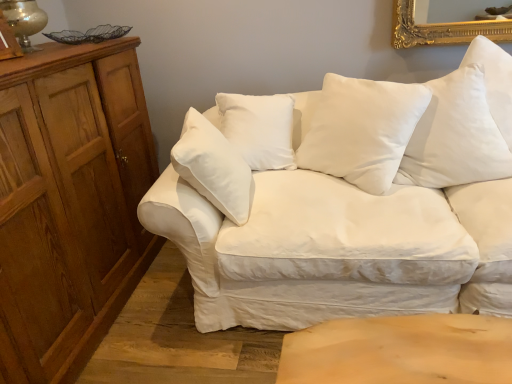
Question: Can you confirm if white cotton pillow at upper right, marked as the first pillow in a right-to-left arrangement, is wider than wooden dresser at left?

Choices:
 (A) no
 (B) yes

Answer: (A)

Question: Can you confirm if white cotton pillow at upper right, marked as the first pillow in a right-to-left arrangement, is shorter than wooden dresser at left?

Choices:
 (A) no
 (B) yes

Answer: (B)

Question: Considering the relative sizes of white cotton pillow at upper right, the 2th pillow when ordered from left to right, and wooden dresser at left in the image provided, is white cotton pillow at upper right, the 2th pillow when ordered from left to right, bigger than wooden dresser at left?

Choices:
 (A) yes
 (B) no

Answer: (B)

Question: From a real-world perspective, is white cotton pillow at upper right, marked as the first pillow in a right-to-left arrangement, physically below wooden dresser at left?

Choices:
 (A) no
 (B) yes

Answer: (A)

Question: Can you confirm if white cotton pillow at upper right, the 2th pillow when ordered from left to right, is positioned to the right of wooden dresser at left?

Choices:
 (A) yes
 (B) no

Answer: (A)

Question: Is white cotton pillow at upper right, the 2th pillow when ordered from left to right, taller than wooden dresser at left?

Choices:
 (A) no
 (B) yes

Answer: (A)

Question: Is matte gold table lamp at upper left at the back of white cotton couch at center?

Choices:
 (A) yes
 (B) no

Answer: (B)

Question: Is white cotton couch at center thinner than matte gold table lamp at upper left?

Choices:
 (A) yes
 (B) no

Answer: (B)

Question: From a real-world perspective, is white cotton couch at center located higher than matte gold table lamp at upper left?

Choices:
 (A) no
 (B) yes

Answer: (A)

Question: From the image's perspective, is white cotton couch at center located above matte gold table lamp at upper left?

Choices:
 (A) no
 (B) yes

Answer: (A)

Question: Considering the relative positions of white cotton couch at center and matte gold table lamp at upper left in the image provided, is white cotton couch at center in front of matte gold table lamp at upper left?

Choices:
 (A) no
 (B) yes

Answer: (B)

Question: From the image's perspective, does white cotton couch at center appear lower than matte gold table lamp at upper left?

Choices:
 (A) yes
 (B) no

Answer: (A)

Question: From a real-world perspective, is white soft cushion at center, arranged as the first pillow when viewed from the left, under wooden dresser at left?

Choices:
 (A) yes
 (B) no

Answer: (B)